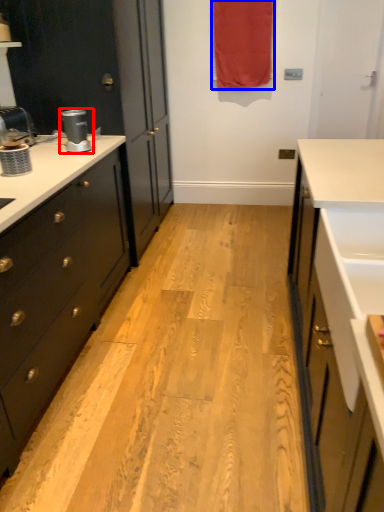
Question: Which object is further to the camera taking this photo, coffee machine (highlighted by a red box) or curtain (highlighted by a blue box)?

Choices:
 (A) coffee machine
 (B) curtain

Answer: (B)